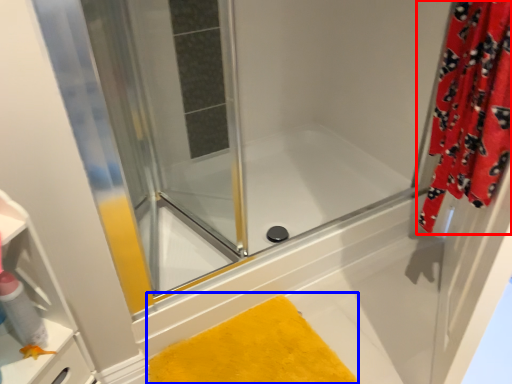
Question: Among these objects, which one is nearest to the camera, curtain (highlighted by a red box) or bath mat (highlighted by a blue box)?

Choices:
 (A) curtain
 (B) bath mat

Answer: (A)